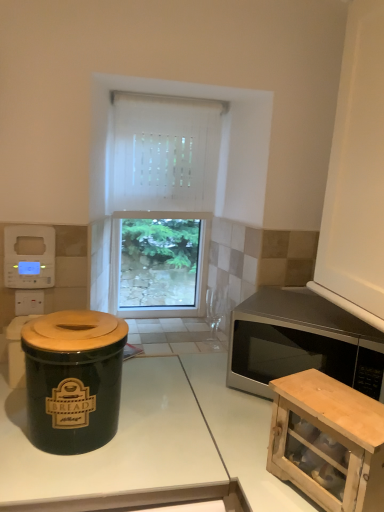
Locate an element on the screen. The image size is (384, 512). free space above wooden cabinet at lower right (from a real-world perspective) is located at coordinates (332, 401).